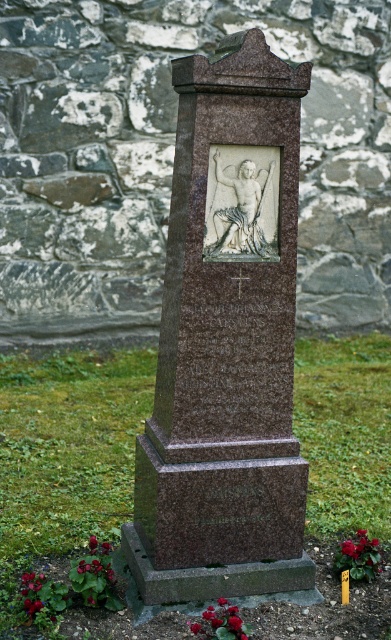
Does brown polished stone at center have a greater width compared to brown polished stone monument at center?

Correct, the width of brown polished stone at center exceeds that of brown polished stone monument at center.

Between point (120, 301) and point (191, 266), which one is positioned in front?

Point (191, 266)

Is point (28, 252) behind point (227, 468)?

That is True.

This screenshot has height=640, width=391. Find the location of `brown polished stone at center`. brown polished stone at center is located at coordinates coord(172,157).

Does brown polished stone monument at center appear on the right side of vivid red petals at lower left?

Indeed, brown polished stone monument at center is positioned on the right side of vivid red petals at lower left.

Is point (231, 368) positioned behind point (32, 596)?

Yes.

Find the location of `brown polished stone monument at center`. brown polished stone monument at center is located at coordinates (225, 346).

Does brown polished stone at center have a greater width compared to vivid red petals at lower left?

Indeed, brown polished stone at center has a greater width compared to vivid red petals at lower left.

Which is behind, point (1, 36) or point (46, 586)?

Point (1, 36)

This screenshot has width=391, height=640. Identify the location of brown polished stone at center. (172, 157).